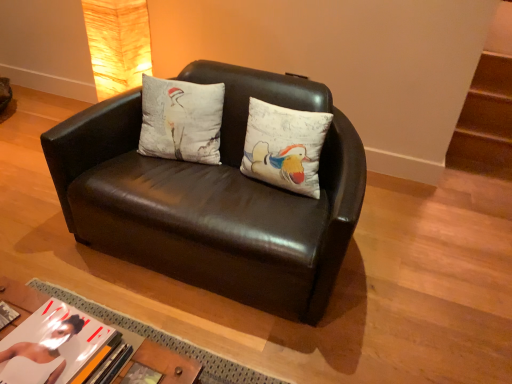
Question: Is point tap(84, 347) positioned closer to the camera than point tap(132, 375)?

Choices:
 (A) farther
 (B) closer

Answer: (B)

Question: Considering their positions, is matte paper book at lower left, arranged as the first book when viewed from the left, located in front of or behind hardcover book at lower center, placed as the second book when sorted from left to right?

Choices:
 (A) front
 (B) behind

Answer: (A)

Question: Which object is positioned closest to the matte beige lampshade at upper left?

Choices:
 (A) matte paper book at lower left, arranged as the first book when viewed from the left
 (B) matte black couch at center
 (C) white cotton cushion at center
 (D) hardcover book at lower center, placed as the second book when sorted from left to right

Answer: (C)

Question: Which of these objects is positioned farthest from the white cotton cushion at center?

Choices:
 (A) matte beige lampshade at upper left
 (B) matte paper book at lower left, arranged as the first book when viewed from the left
 (C) hardcover book at lower center, placed as the 1th book when sorted from right to left
 (D) matte black couch at center

Answer: (C)